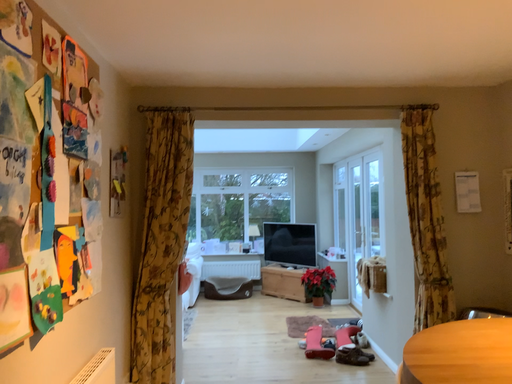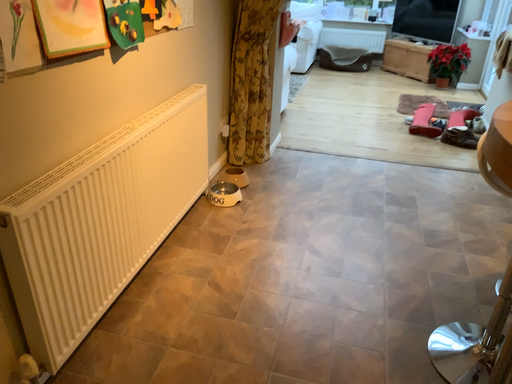
Question: Which way did the camera rotate in the video?

Choices:
 (A) rotated left
 (B) rotated right

Answer: (A)